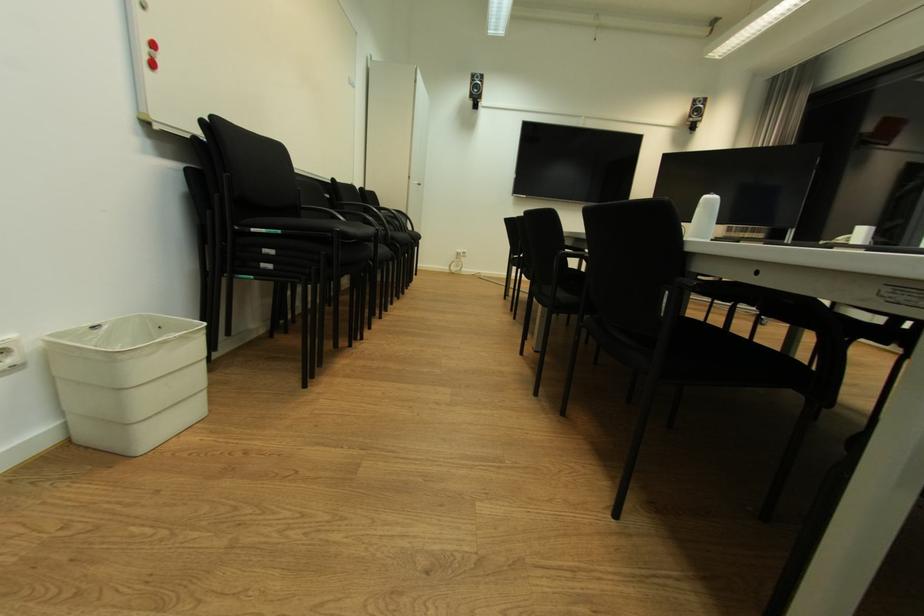
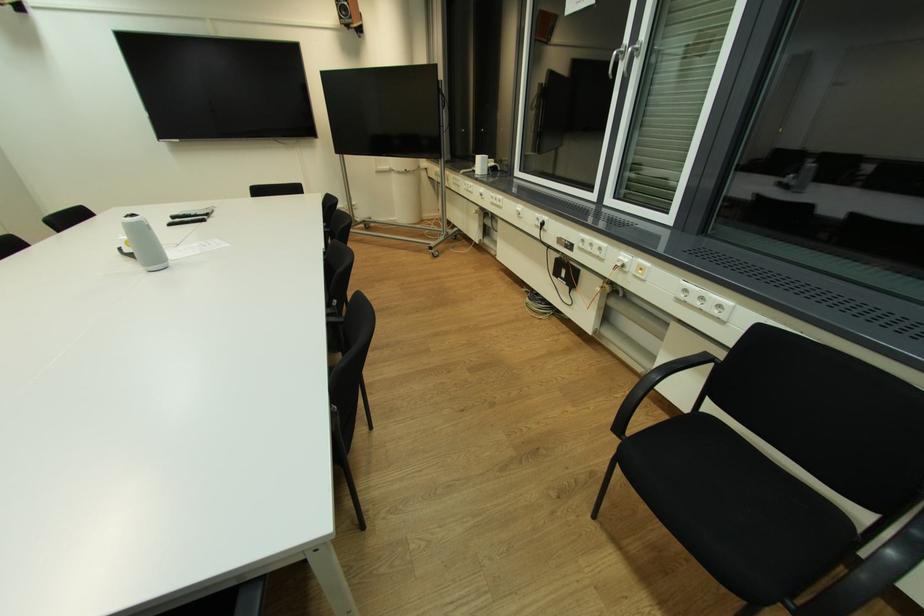
Find the pixel in the second image that matches (700,114) in the first image.

(349, 15)